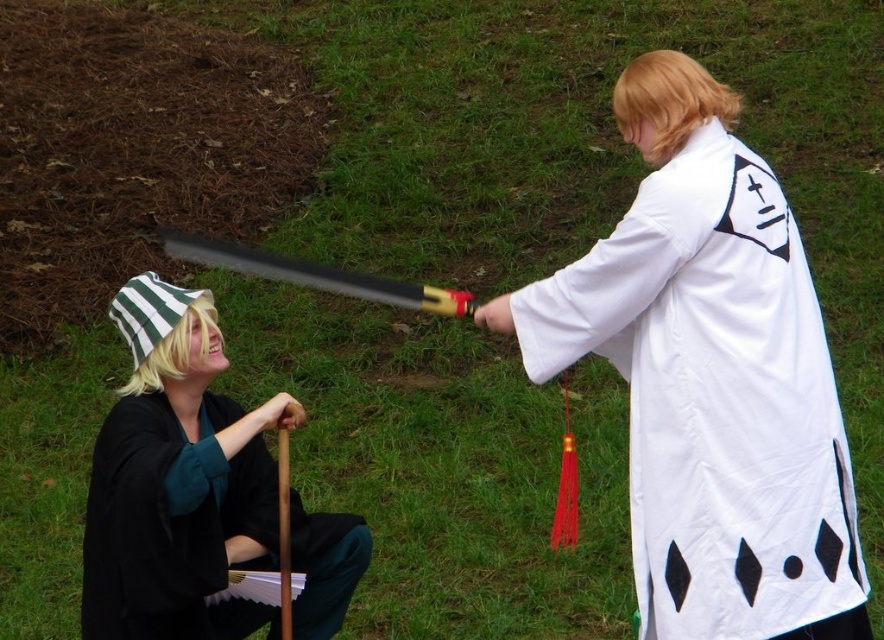
You are standing in front of the two people in the image. Which of the two points, point (672, 342) or point (159, 296), is closer to you?

Point (672, 342) is closer to the viewer than point (159, 296).

You are a photographer trying to capture a photo of both the white fabric kimono at upper right and the black matte kimono at lower left in the same frame. Based on their positions, which kimono will appear closer to the camera in the photo?

The white fabric kimono at upper right will appear closer to the camera because it is further to the viewer than the black matte kimono at lower left.

You are a photographer trying to capture a picture of the scene. The camera is positioned at the center of the image. Which object, the white fabric kimono at upper right or the person on the left, is closer to the camera?

The white fabric kimino at upper right is located at point [714,397], so it is closer to the camera than the person on the left.